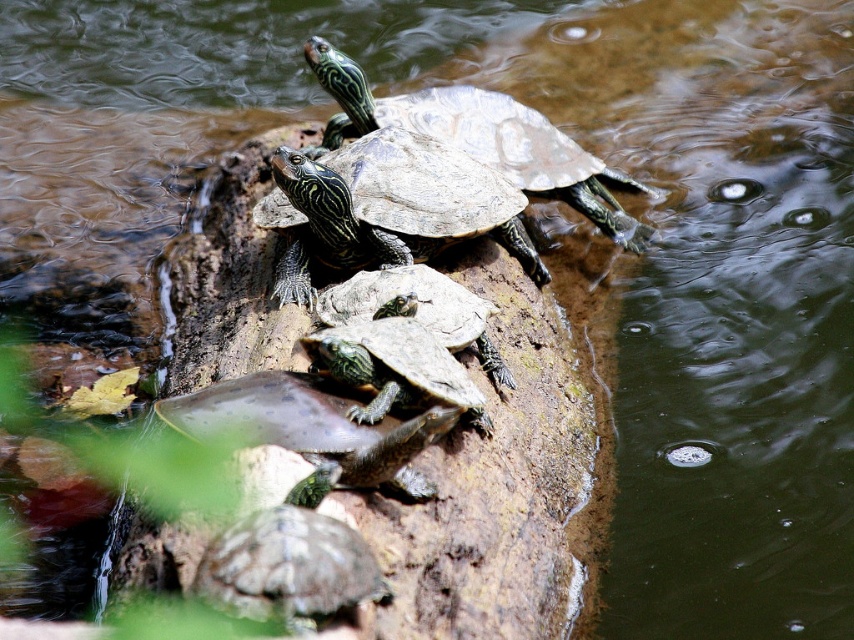
You are a wildlife photographer aiming to capture a closeup of the shiny dark green tortoise at center and the shiny green tortoise at upper center. Since the water is murky, you need to get as close as possible. Which tortoise should you approach first if you want to minimize disturbance? Explain your reasoning based on their sizes.

The shiny dark green tortoise at center is smaller than the shiny green tortoise at upper center. Since smaller animals might be more easily startled by sudden movements, approaching the smaller one first could allow you to get closer without causing alarm, minimizing disturbance to both.

You are a wildlife photographer aiming to capture a photo of the shiny dark green tortoise at center and the shiny green tortoise at upper center. Since you want to focus on the taller one, which tortoise should you focus on?

The shiny green tortoise at upper center is taller than the shiny dark green tortoise at center, so you should focus on the shiny green tortoise at upper center.